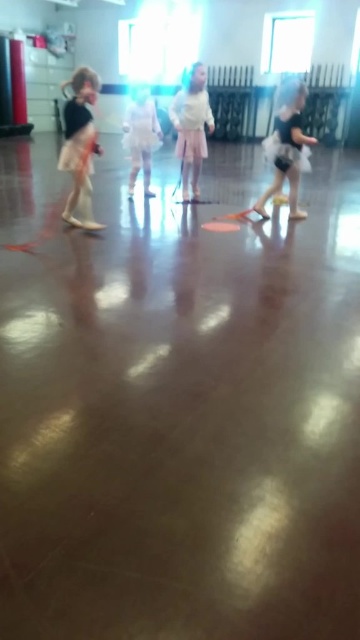
Based on the photo, who is more distant from viewer, (146, 99) or (291, 163)?

The point (146, 99) is behind.

Is white satin dress at center to the left of white satin dress at right from the viewer's perspective?

Correct, you'll find white satin dress at center to the left of white satin dress at right.

Locate an element on the screen. The width and height of the screenshot is (360, 640). white satin dress at center is located at coordinates (141, 134).

Where is `white satin dress at center`? The width and height of the screenshot is (360, 640). white satin dress at center is located at coordinates (141, 134).

Does point (297, 124) come farther from viewer compared to point (132, 125)?

No, it is in front of (132, 125).

Does point (254, 209) come in front of point (140, 104)?

Yes, point (254, 209) is in front of point (140, 104).

The height and width of the screenshot is (640, 360). What do you see at coordinates (288, 148) in the screenshot?
I see `black tulle skirt at right` at bounding box center [288, 148].

This screenshot has width=360, height=640. I want to click on black tulle skirt at right, so click(288, 148).

Which is in front, point (78, 161) or point (206, 113)?

Point (78, 161) is in front.

At what (x,y) coordinates should I click in order to perform the action: click on matte black tutu at left. Please return your answer as a coordinate pair (x, y). Looking at the image, I should click on (79, 145).